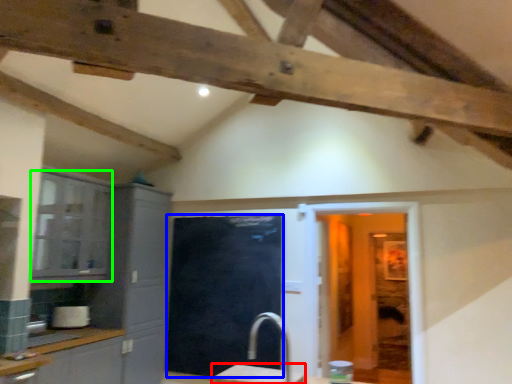
Question: Based on their relative distances, which object is nearer to table (highlighted by a red box)? Choose from glass door (highlighted by a blue box) and cabinetry (highlighted by a green box).

Choices:
 (A) glass door
 (B) cabinetry

Answer: (A)